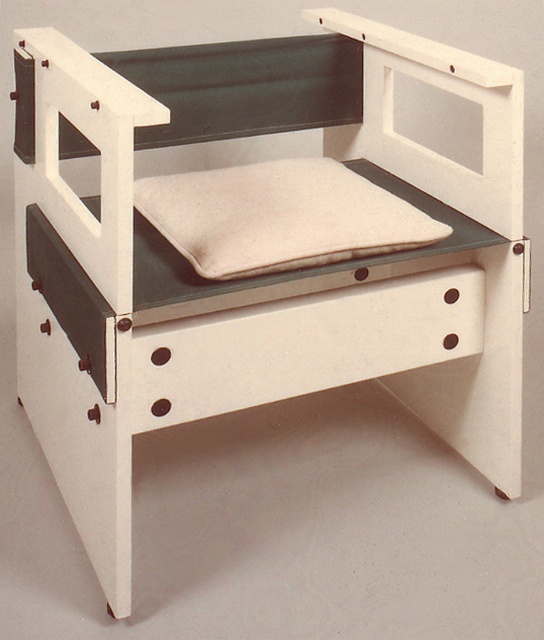
You are a furniture designer examining the chair. You notice a point at coordinates (300, 346). What object is located at this point?

The point at coordinates (300, 346) marks the white matte drawer at lower center.

You are organizing a small storage unit and need to place both the white matte drawer at lower center and the beige fabric cushion at center into it. Given their sizes, which one should you place first to maximize space efficiency?

The white matte drawer at lower center occupies less space than the beige fabric cushion at center, so you should place the beige fabric cushion at center first to make room for the smaller item.

You are sitting on the beige fabric cushion at center of a modern chair. You want to place a small book on the white matte drawer at lower center. Can you reach the drawer without getting up?

The white matte drawer at lower center is below the beige fabric cushion at center, so yes, you can reach it while sitting because it is positioned lower than the cushion.